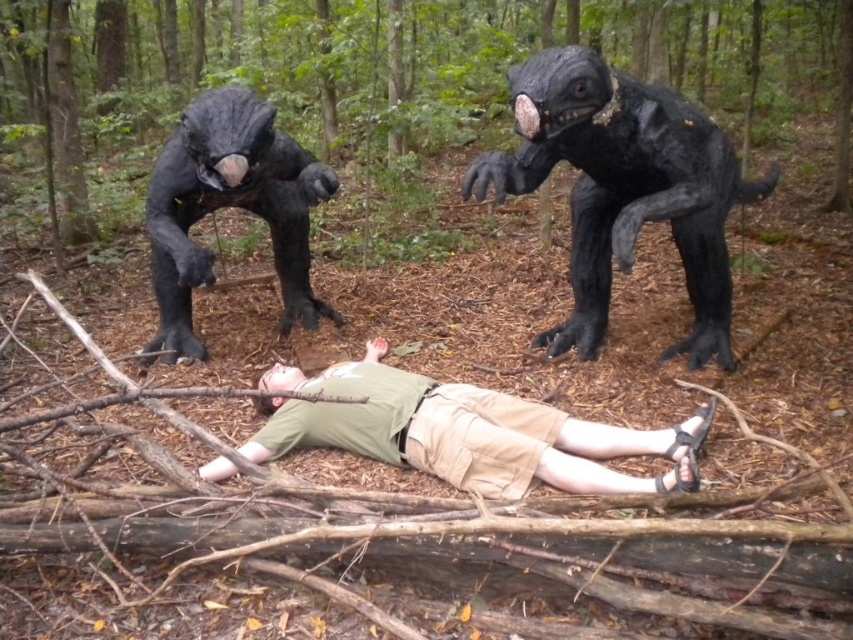
You are a hiker who has just encountered this scene. You need to quickly assess the situation. Which object is taller between the shiny black creature at upper center and the green cotton shirt at center?

The shiny black creature at upper center is taller than the green cotton shirt at center.

You are a hiker who has just encountered these creatures. You need to quickly assess the situation. Which object is closer to the ground, the green cotton shirt at center or the shiny black creature at upper left?

The green cotton shirt at center is shorter than the shiny black creature at upper left, so the green cotton shirt at center is closer to the ground.